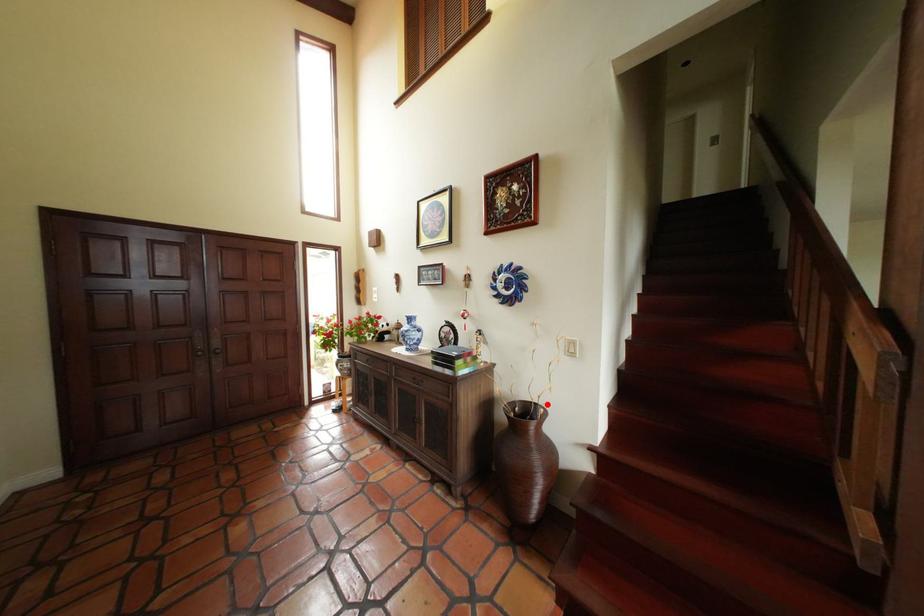
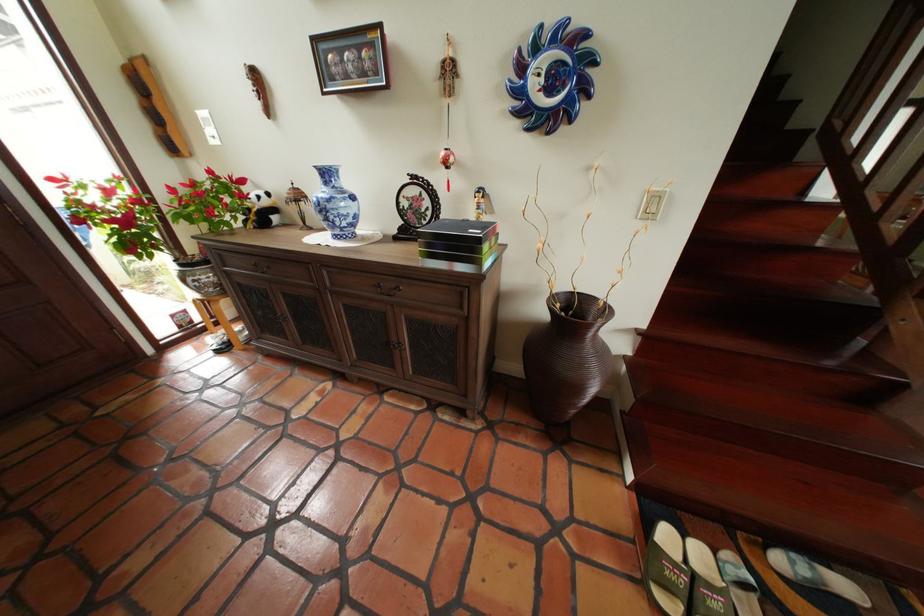
Question: I am providing you with two images of the same scene from different viewpoints. A red point is shown in image1. For the corresponding object point in image2, is it positioned nearer or farther from the camera?

Choices:
 (A) Nearer
 (B) Farther

Answer: (A)